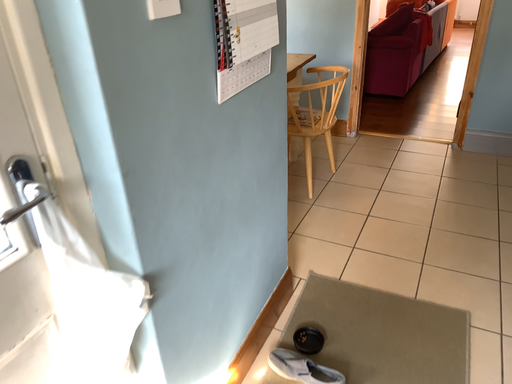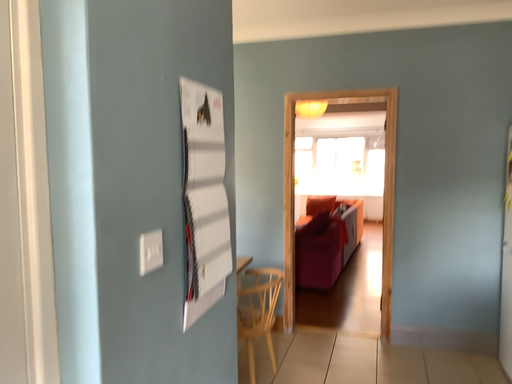
Question: Which way did the camera rotate in the video?

Choices:
 (A) rotated downward
 (B) rotated upward

Answer: (B)